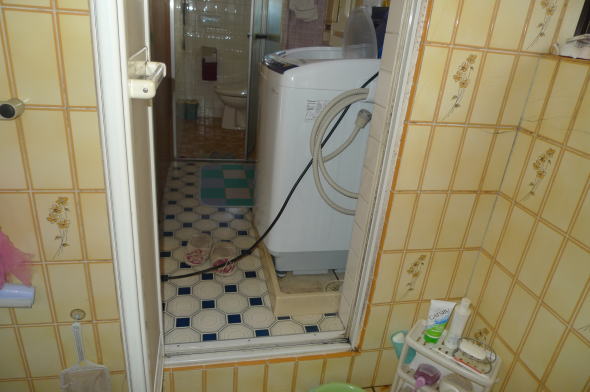
This screenshot has width=590, height=392. What are the coordinates of `floor tile` in the screenshot? It's located at (241, 299), (186, 213), (238, 228), (183, 183), (186, 305), (247, 309), (267, 330).